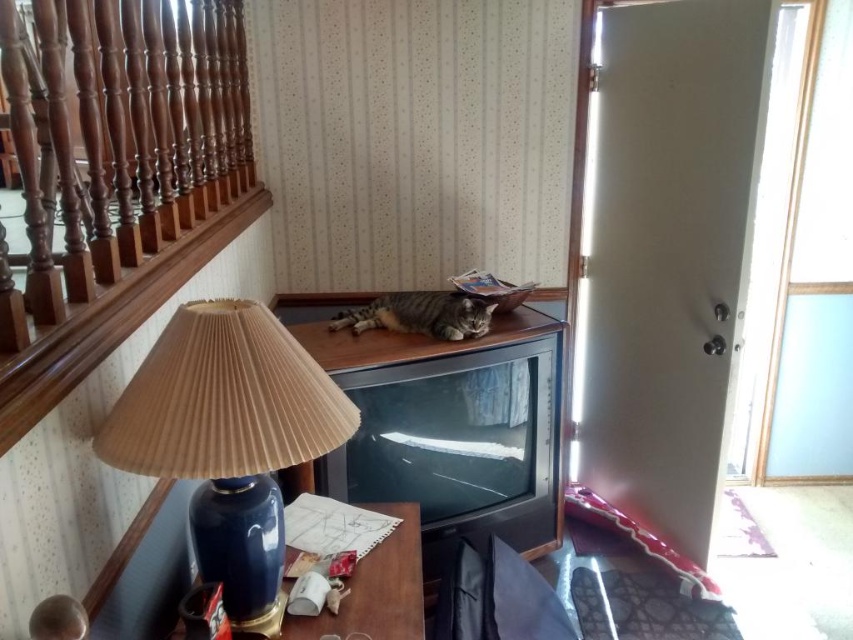
Question: Based on their relative distances, which object is nearer to the brown wood railing at upper left?

Choices:
 (A) blue glossy vase at lower left
 (B) blue ceramic lampshade at upper left

Answer: (B)

Question: Which of the following is the farthest from the observer?

Choices:
 (A) blue ceramic lampshade at upper left
 (B) blue glossy vase at lower left
 (C) brown wood railing at upper left

Answer: (B)

Question: Observing the image, what is the correct spatial positioning of blue ceramic lampshade at upper left in reference to blue glossy vase at lower left?

Choices:
 (A) right
 (B) left

Answer: (B)

Question: Estimate the real-world distances between objects in this image. Which object is closer to the blue glossy vase at lower left?

Choices:
 (A) brown wood railing at upper left
 (B) blue ceramic lampshade at upper left

Answer: (B)

Question: Does brown wood railing at upper left appear over blue glossy vase at lower left?

Choices:
 (A) no
 (B) yes

Answer: (B)

Question: Is brown wood railing at upper left smaller than blue ceramic lampshade at upper left?

Choices:
 (A) no
 (B) yes

Answer: (A)